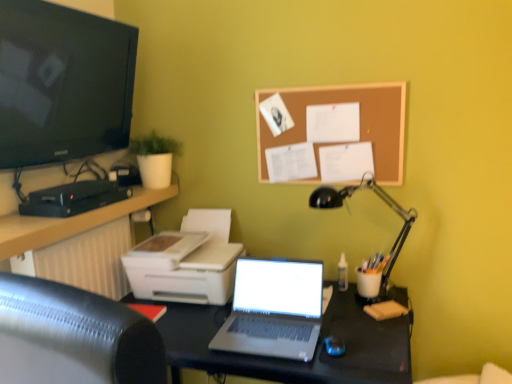
Question: Is white plastic printer at lower left at the back of black glossy screen at upper left?

Choices:
 (A) no
 (B) yes

Answer: (A)

Question: Is black glossy screen at upper left in front of white plastic printer at lower left?

Choices:
 (A) yes
 (B) no

Answer: (A)

Question: Is black glossy screen at upper left bigger than white plastic printer at lower left?

Choices:
 (A) yes
 (B) no

Answer: (A)

Question: From the image's perspective, is black glossy screen at upper left under white plastic printer at lower left?

Choices:
 (A) yes
 (B) no

Answer: (B)

Question: Is the surface of black glossy screen at upper left in direct contact with white plastic printer at lower left?

Choices:
 (A) no
 (B) yes

Answer: (A)

Question: Considering the relative positions of black glossy screen at upper left and white plastic printer at lower left in the image provided, is black glossy screen at upper left to the left of white plastic printer at lower left from the viewer's perspective?

Choices:
 (A) no
 (B) yes

Answer: (B)

Question: Is white plastic printer at lower left aimed at silver metallic laptop at center?

Choices:
 (A) yes
 (B) no

Answer: (B)

Question: From a real-world perspective, is white plastic printer at lower left over silver metallic laptop at center?

Choices:
 (A) no
 (B) yes

Answer: (B)

Question: Are white plastic printer at lower left and silver metallic laptop at center far apart?

Choices:
 (A) yes
 (B) no

Answer: (B)

Question: Is silver metallic laptop at center at the back of white plastic printer at lower left?

Choices:
 (A) yes
 (B) no

Answer: (B)

Question: Is white plastic printer at lower left positioned behind silver metallic laptop at center?

Choices:
 (A) yes
 (B) no

Answer: (A)

Question: Is the position of white plastic printer at lower left less distant than that of silver metallic laptop at center?

Choices:
 (A) yes
 (B) no

Answer: (B)

Question: From a real-world perspective, is black metal desk lamp at right on top of white plastic printer at lower left?

Choices:
 (A) no
 (B) yes

Answer: (B)